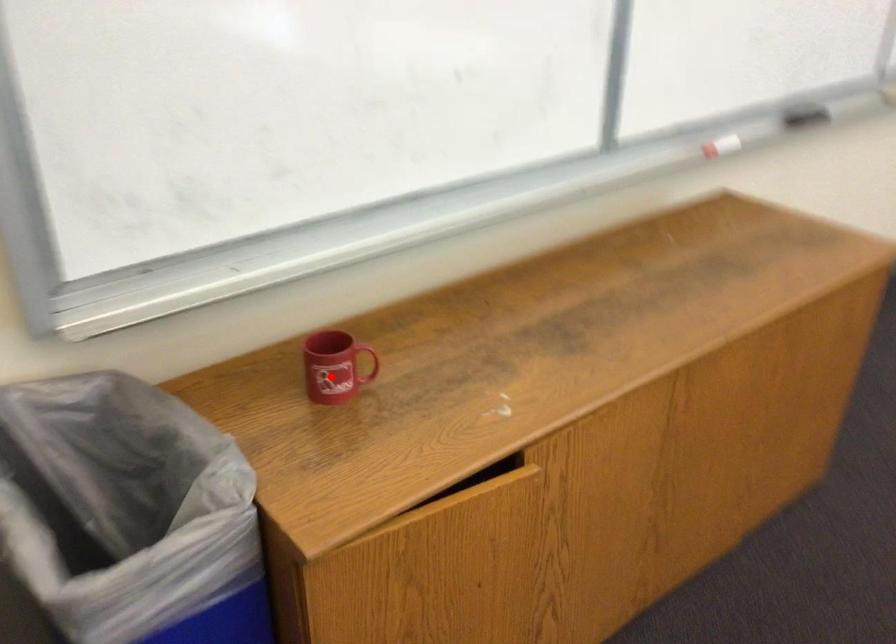
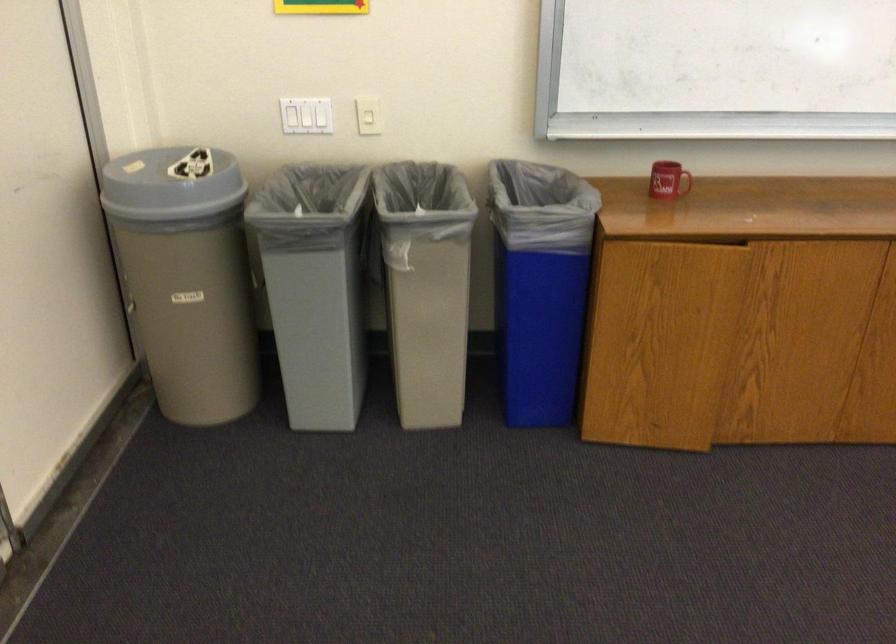
Question: I am providing you with two images of the same scene from different viewpoints. In image1, a red point is highlighted. Considering the same 3D point in image2, which of the following is correct?

Choices:
 (A) It is closer
 (B) It is farther

Answer: (B)